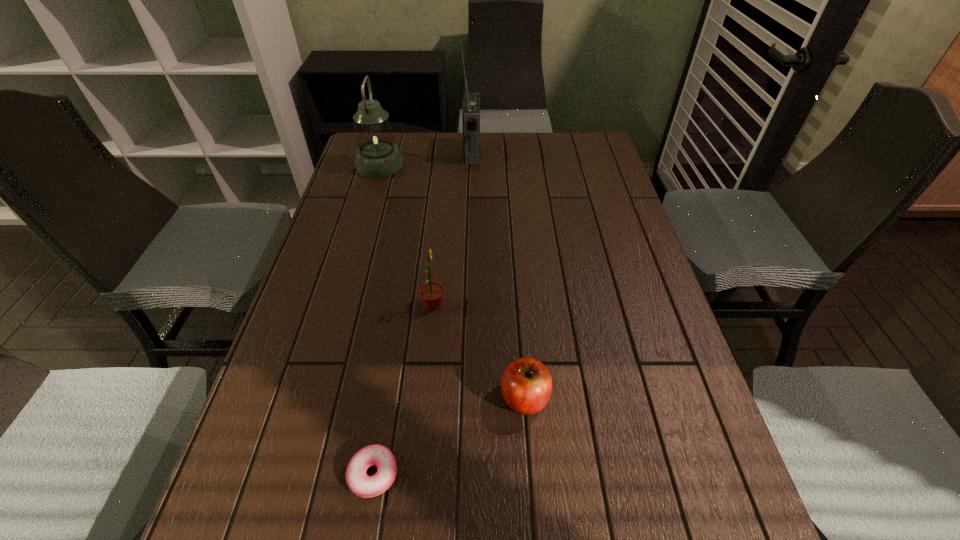
Find the location of a particular element. The image size is (960, 540). free space between the sunflower and the doughnut is located at coordinates (403, 389).

The width and height of the screenshot is (960, 540). Identify the location of vacant space in between the fourth object from right to left and the fourth shortest object. (376, 319).

Identify the location of free point between the tallest object and the rightmost object. (498, 275).

Identify which object is the third closest to the fourth object from left to right. Please provide its 2D coordinates. Your answer should be formatted as a tuple, i.e. [(x, y)], where the tuple contains the x and y coordinates of a point satisfying the conditions above.

[(526, 385)]

The width and height of the screenshot is (960, 540). I want to click on object that is the third closest to the radio receiver, so click(x=526, y=385).

Identify the location of free space that satisfies the following two spatial constraints: 1. on the face of the third farthest object; 2. on the left side of the apple. The width and height of the screenshot is (960, 540). (424, 398).

You are a GUI agent. You are given a task and a screenshot of the screen. Output one action in this format:
    pyautogui.click(x=<x>, y=<y>)
    Task: Click on the free space that satisfies the following two spatial constraints: 1. on the display of the radio receiver; 2. on the left side of the second nearest object
    The height and width of the screenshot is (540, 960).
    Given the screenshot: What is the action you would take?
    pyautogui.click(x=466, y=398)

You are a GUI agent. You are given a task and a screenshot of the screen. Output one action in this format:
    pyautogui.click(x=<x>, y=<y>)
    Task: Click on the free location that satisfies the following two spatial constraints: 1. on the face of the third farthest object; 2. on the back side of the fourth tallest object
    The height and width of the screenshot is (540, 960).
    Given the screenshot: What is the action you would take?
    pyautogui.click(x=424, y=398)

I want to click on vacant space that satisfies the following two spatial constraints: 1. on the display of the fourth object from left to right; 2. on the right side of the second nearest object, so click(x=466, y=398).

Where is `free spot that satisfies the following two spatial constraints: 1. on the back side of the second shortest object; 2. on the display of the radio receiver`? free spot that satisfies the following two spatial constraints: 1. on the back side of the second shortest object; 2. on the display of the radio receiver is located at coordinates (x=506, y=152).